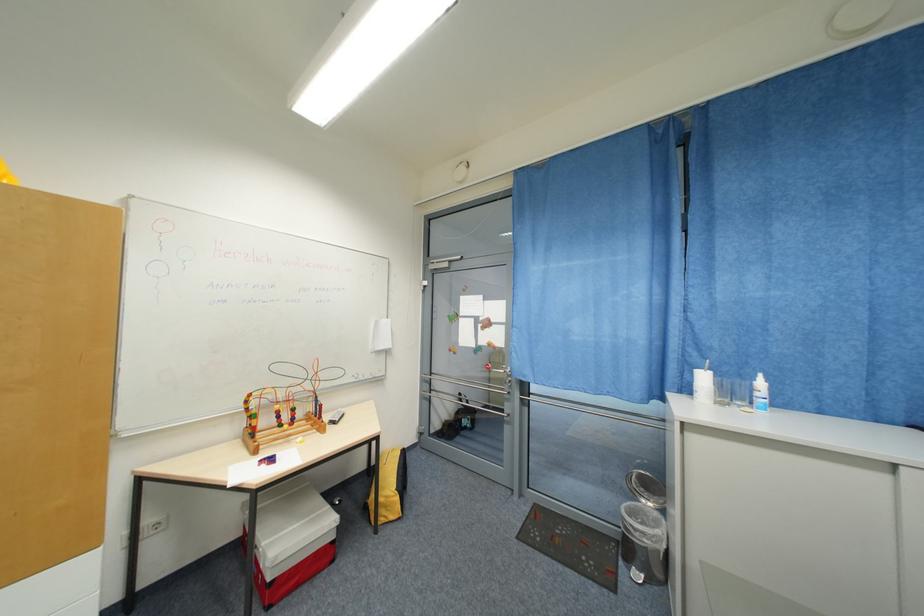
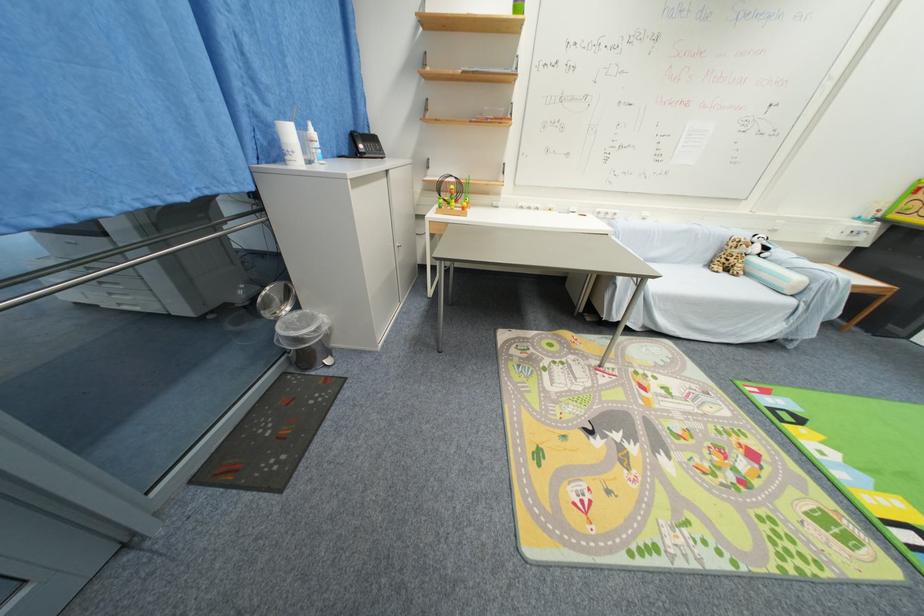
Find the pixel in the second image that matches the point at 669,514 in the first image.

(301, 309)